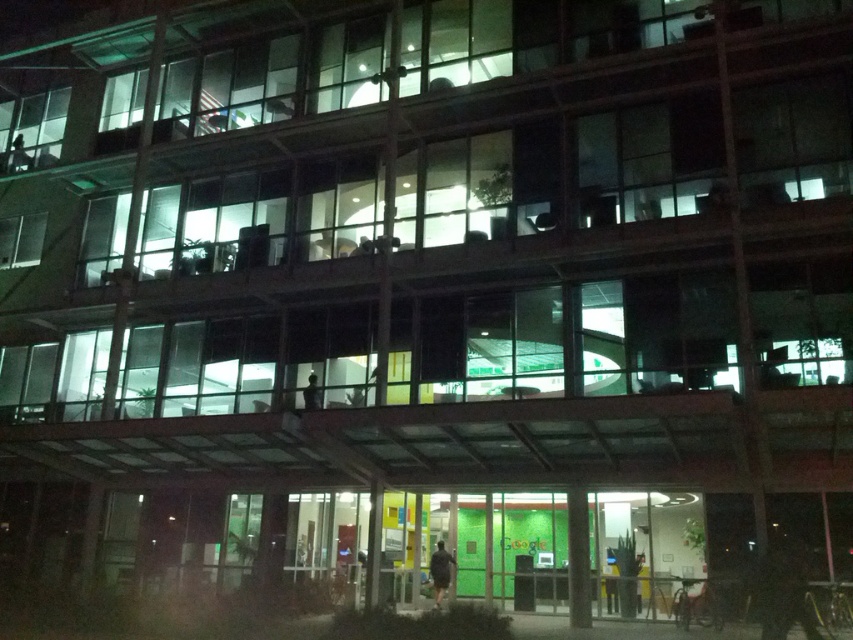
Question: Is dark gray fabric jacket at lower center to the right of smooth black figure at center from the viewer's perspective?

Choices:
 (A) yes
 (B) no

Answer: (A)

Question: Is dark gray fabric jacket at lower center closer to camera compared to smooth black figure at center?

Choices:
 (A) yes
 (B) no

Answer: (A)

Question: Among these points, which one is nearest to the camera?

Choices:
 (A) (306, 403)
 (B) (434, 604)

Answer: (B)

Question: Among these objects, which one is nearest to the camera?

Choices:
 (A) smooth black figure at center
 (B) dark gray fabric jacket at lower center

Answer: (B)

Question: Is dark gray fabric jacket at lower center to the right of smooth black figure at center from the viewer's perspective?

Choices:
 (A) no
 (B) yes

Answer: (B)

Question: Among these points, which one is farthest from the camera?

Choices:
 (A) (309, 378)
 (B) (439, 589)

Answer: (A)